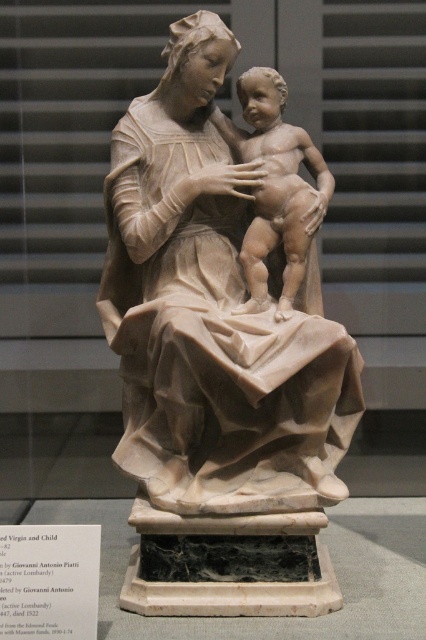
Between white marble statue at center and matte beige baby at center, which one has less height?

With less height is matte beige baby at center.

Is white marble statue at center thinner than matte beige baby at center?

In fact, white marble statue at center might be wider than matte beige baby at center.

Measure the distance between white marble statue at center and camera.

white marble statue at center and camera are 2.31 meters apart.

Identify the location of white marble statue at center. (215, 365).